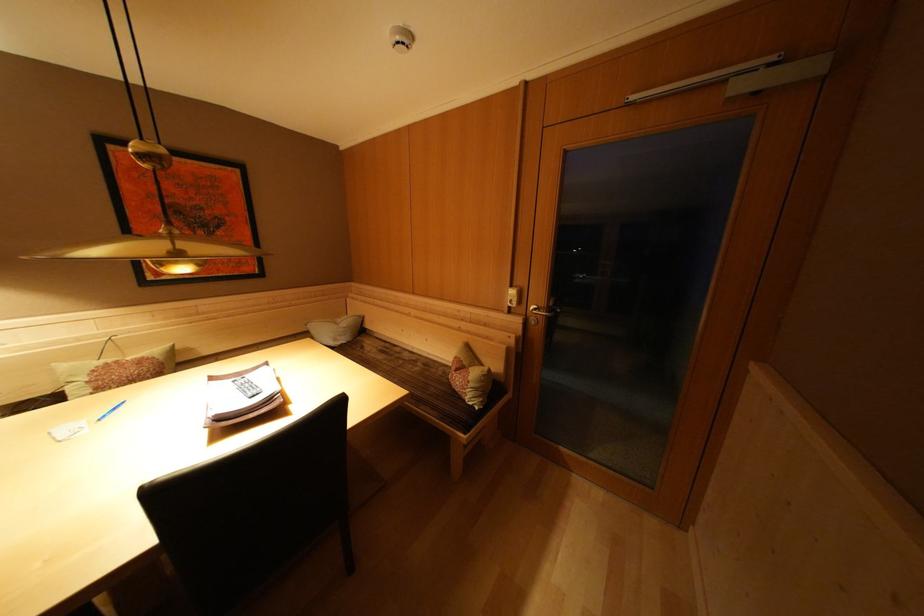
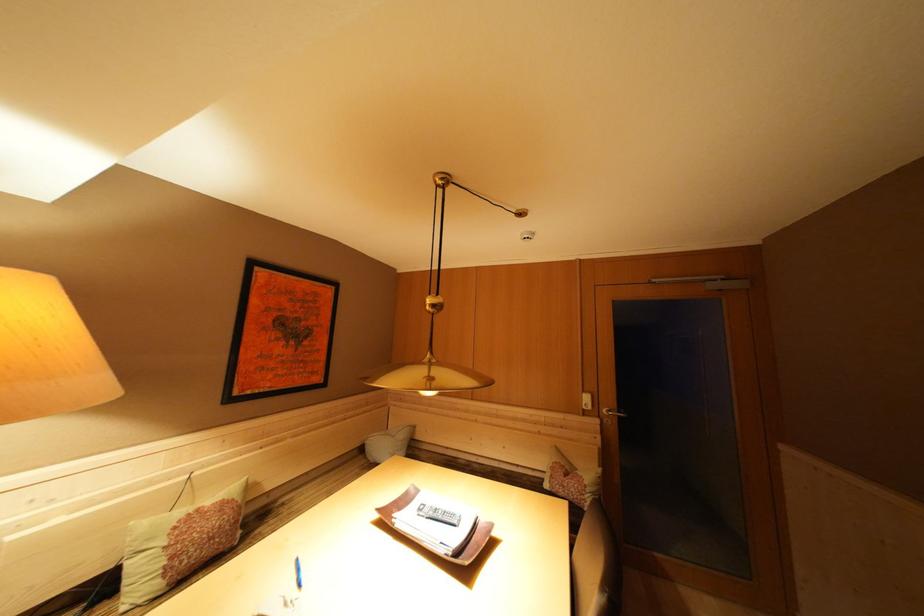
In the second image, find the point that corresponds to (477,383) in the first image.

(592, 487)